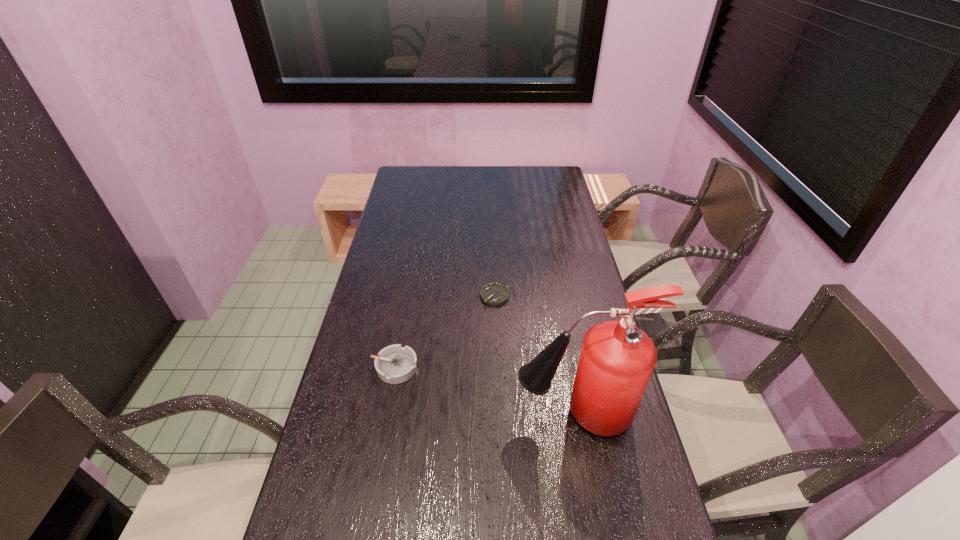
Where is `free space located 0.190m on the right of the farther ashtray`? The height and width of the screenshot is (540, 960). free space located 0.190m on the right of the farther ashtray is located at coordinates (567, 295).

Image resolution: width=960 pixels, height=540 pixels. What are the coordinates of `object that is at the left edge` in the screenshot? It's located at (395, 364).

You are a GUI agent. You are given a task and a screenshot of the screen. Output one action in this format:
    pyautogui.click(x=<x>, y=<y>)
    Task: Click on the object that is at the right edge
    The image size is (960, 540).
    Given the screenshot: What is the action you would take?
    pyautogui.click(x=617, y=358)

Locate an element on the screen. vacant space at the far edge is located at coordinates (494, 179).

Find the location of `vacant area at the left edge`. vacant area at the left edge is located at coordinates (370, 506).

In the image, there is a desktop. At what (x,y) coordinates should I click in order to perform the action: click on vacant space at the right edge. Please return your answer as a coordinate pair (x, y). This screenshot has height=540, width=960. Looking at the image, I should click on (548, 281).

Where is `vacant space at the far left corner of the desktop`? The width and height of the screenshot is (960, 540). vacant space at the far left corner of the desktop is located at coordinates (396, 187).

In the image, there is a desktop. At what (x,y) coordinates should I click in order to perform the action: click on vacant space at the far right corner. Please return your answer as a coordinate pair (x, y). This screenshot has height=540, width=960. Looking at the image, I should click on (543, 173).

You are a GUI agent. You are given a task and a screenshot of the screen. Output one action in this format:
    pyautogui.click(x=<x>, y=<y>)
    Task: Click on the free space that is in between the second tallest object and the fire extinguisher
    
    Given the screenshot: What is the action you would take?
    pyautogui.click(x=485, y=390)

Where is `free space between the nearest object and the farthest object`? This screenshot has height=540, width=960. free space between the nearest object and the farthest object is located at coordinates click(535, 355).